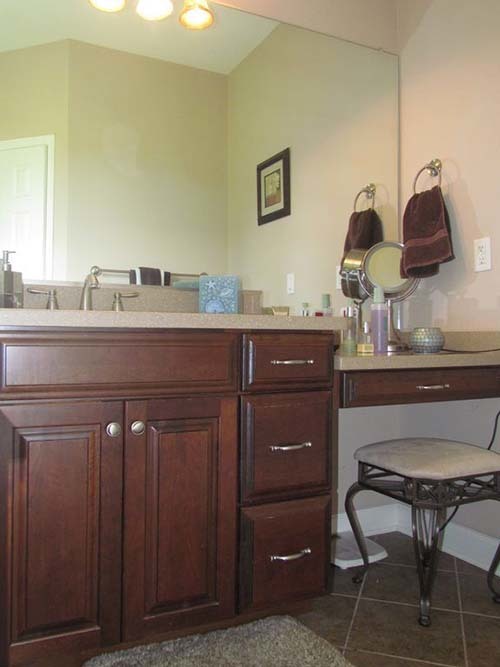
Locate an element on the screen. This screenshot has width=500, height=667. faucet is located at coordinates (85, 305).